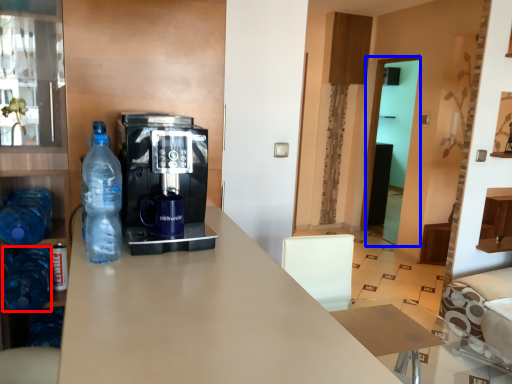
Question: Which object appears farthest to the camera in this image, bottle (highlighted by a red box) or glass door (highlighted by a blue box)?

Choices:
 (A) bottle
 (B) glass door

Answer: (B)